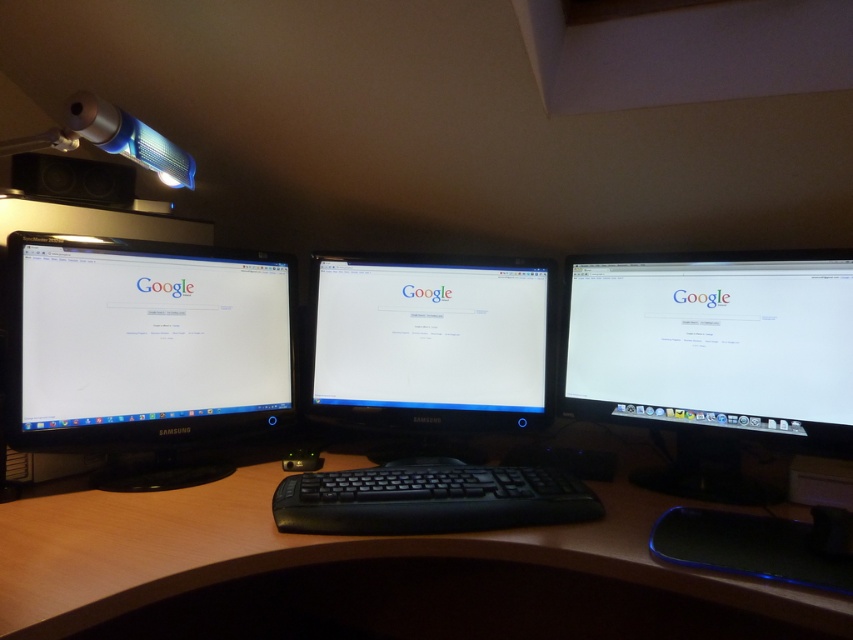
Question: Among these points, which one is nearest to the camera?

Choices:
 (A) (451, 336)
 (B) (340, 564)
 (C) (772, 300)

Answer: (C)

Question: Can you confirm if brown wood computer desk at center is wider than satin black monitor at center?

Choices:
 (A) no
 (B) yes

Answer: (B)

Question: From the image, what is the correct spatial relationship of black glossy monitor at left in relation to white glossy monitor at right?

Choices:
 (A) left
 (B) right

Answer: (A)

Question: Which of the following is the closest to the observer?

Choices:
 (A) (531, 314)
 (B) (44, 442)
 (C) (448, 600)
 (D) (519, 513)

Answer: (D)

Question: Does satin black monitor at center come behind black matte keyboard at center?

Choices:
 (A) yes
 (B) no

Answer: (A)

Question: Which object appears closest to the camera in this image?

Choices:
 (A) black glossy monitor at left
 (B) white glossy monitor at right
 (C) brown wood computer desk at center

Answer: (C)